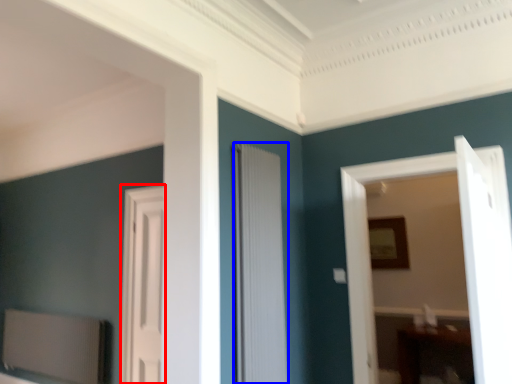
Question: Which point is closer to the camera, door (highlighted by a red box) or door (highlighted by a blue box)?

Choices:
 (A) door
 (B) door

Answer: (B)